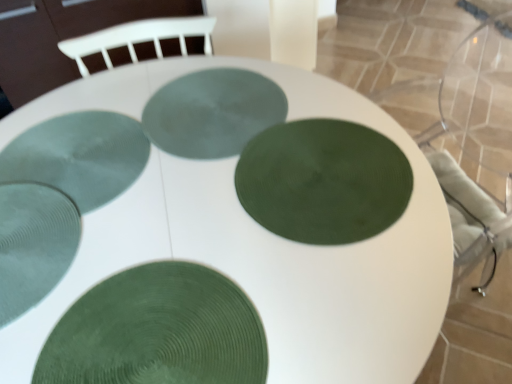
Locate an element on the screen. This screenshot has height=384, width=512. free area below green textured glass plate at center, positioned as the 2th glass plate in back-to-front order (from a real-world perspective) is located at coordinates (50, 172).